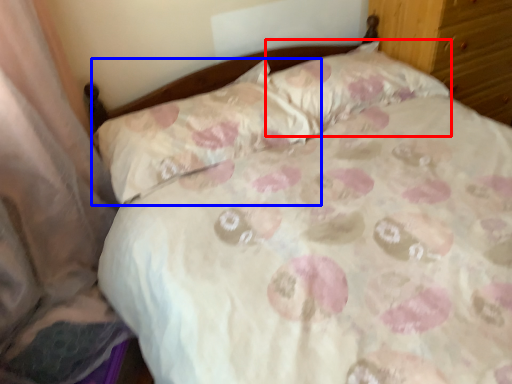
Question: Which object is closer to the camera taking this photo, pillow (highlighted by a red box) or pillow (highlighted by a blue box)?

Choices:
 (A) pillow
 (B) pillow

Answer: (B)